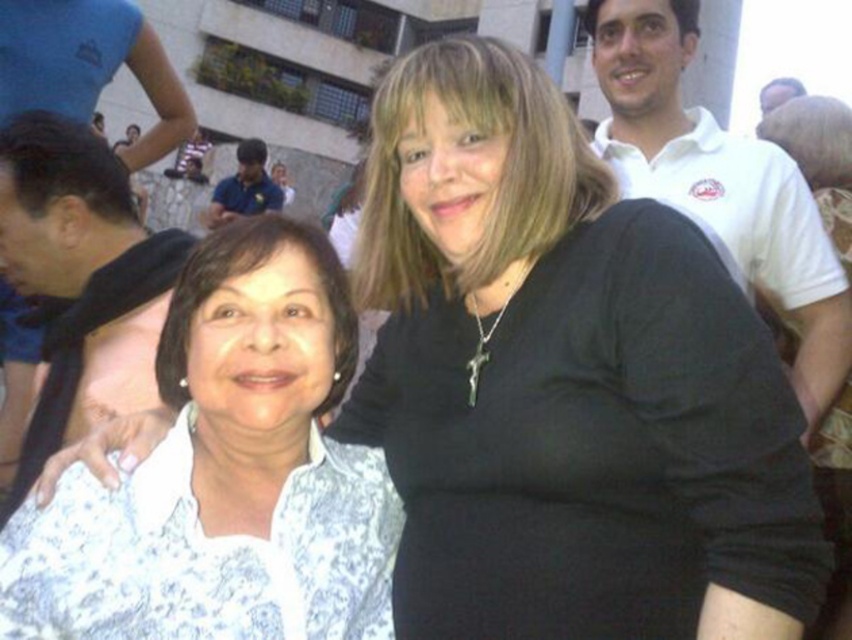
Who is positioned more to the right, black scarf at left or blue shirt at center?

From the viewer's perspective, black scarf at left appears more on the right side.

Does black scarf at left have a lesser height compared to blue shirt at center?

In fact, black scarf at left may be taller than blue shirt at center.

Measure the distance between black scarf at left and camera.

A distance of 20.93 meters exists between black scarf at left and camera.

Find the location of `black scarf at left`. black scarf at left is located at coordinates (73, 260).

Which is above, white cotton polo shirt at upper right or black scarf at left?

Positioned higher is white cotton polo shirt at upper right.

Does white cotton polo shirt at upper right have a lesser height compared to black scarf at left?

No, white cotton polo shirt at upper right is not shorter than black scarf at left.

Locate an element on the screen. The height and width of the screenshot is (640, 852). white cotton polo shirt at upper right is located at coordinates (721, 182).

Identify the location of white cotton polo shirt at upper right. (721, 182).

Is point (180, 547) behind point (727, 209)?

No, it is not.

Which is above, white lace blouse at center or white cotton polo shirt at upper right?

white cotton polo shirt at upper right is higher up.

Image resolution: width=852 pixels, height=640 pixels. Describe the element at coordinates (226, 474) in the screenshot. I see `white lace blouse at center` at that location.

This screenshot has width=852, height=640. I want to click on white lace blouse at center, so click(x=226, y=474).